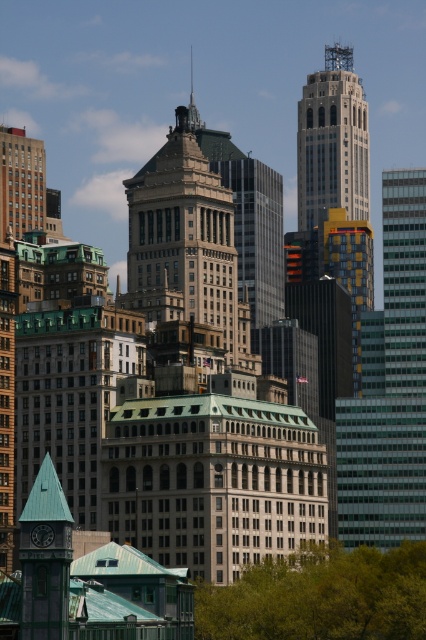
Does yellow mosaic tile building at right appear on the right side of green leafy tree at lower center?

Indeed, yellow mosaic tile building at right is positioned on the right side of green leafy tree at lower center.

Between yellow mosaic tile building at right and green leafy tree at lower center, which one has less height?

green leafy tree at lower center

Is point (383, 529) more distant than point (294, 580)?

That is True.

At what (x,y) coordinates should I click in order to perform the action: click on yellow mosaic tile building at right. Please return your answer as a coordinate pair (x, y). Looking at the image, I should click on (388, 387).

Is light gray concrete skyscraper at upper center closer to camera compared to green matte clock tower at lower left?

No, light gray concrete skyscraper at upper center is further to the viewer.

Between point (333, 150) and point (65, 632), which one is positioned in front?

Point (65, 632) is more forward.

Where is `light gray concrete skyscraper at upper center`? light gray concrete skyscraper at upper center is located at coordinates (333, 141).

You are a GUI agent. You are given a task and a screenshot of the screen. Output one action in this format:
    pyautogui.click(x=<x>, y=<y>)
    Task: Click on the light gray concrete skyscraper at upper center
    
    Given the screenshot: What is the action you would take?
    pyautogui.click(x=333, y=141)

Does matte brown building at center appear on the right side of green matte clock tower at lower left?

Correct, you'll find matte brown building at center to the right of green matte clock tower at lower left.

Is point (149, 198) positioned behind point (66, 509)?

Yes, point (149, 198) is farther from viewer.

The width and height of the screenshot is (426, 640). In order to click on matte brown building at center in this screenshot , I will do `click(186, 253)`.